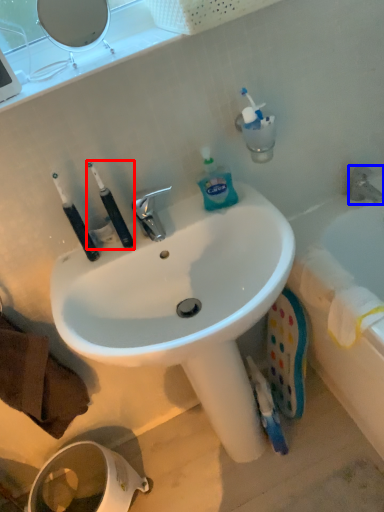
Question: Which of the following is the farthest to the observer, toiletries (highlighted by a red box) or tap (highlighted by a blue box)?

Choices:
 (A) toiletries
 (B) tap

Answer: (B)